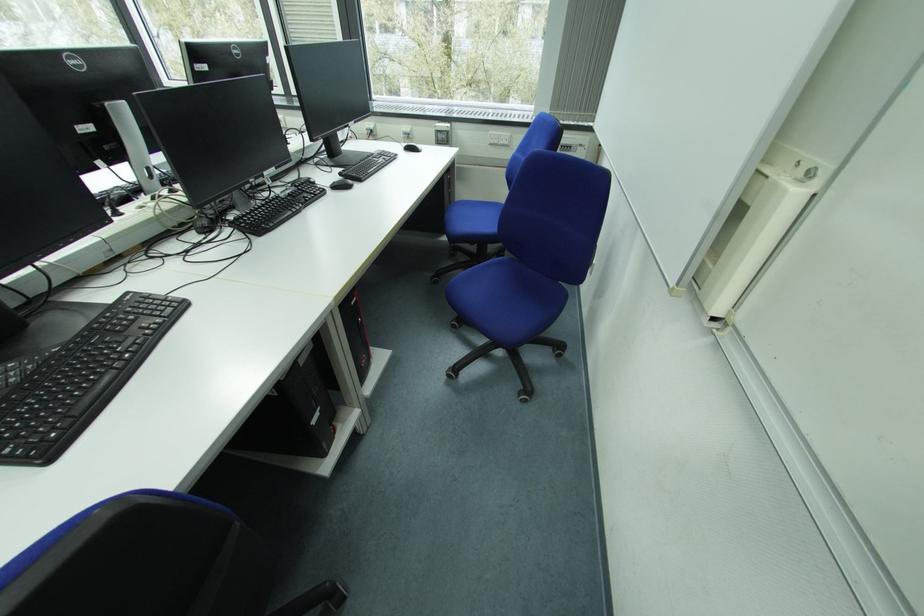
The location [310,407] corresponds to which object?

This point indicates the black computer tower.